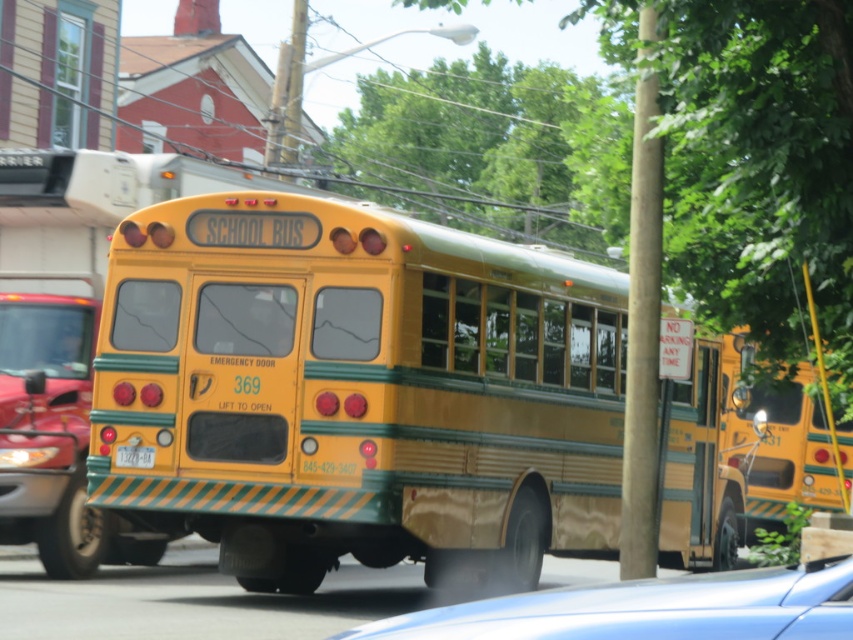
You are a pedestrian standing on the sidewalk and see the metallic blue car at lower center and the matte yellow school bus at center. Which vehicle is closer to the left edge of the road?

The metallic blue car at lower center is positioned on the left side of the matte yellow school bus at center, so it is closer to the left edge of the road.

Consider the image. You are a driver approaching an intersection and see a matte black bus at left and a matte yellow school bus at center. Which bus is taller?

The matte black bus at left is taller than the matte yellow school bus at center.